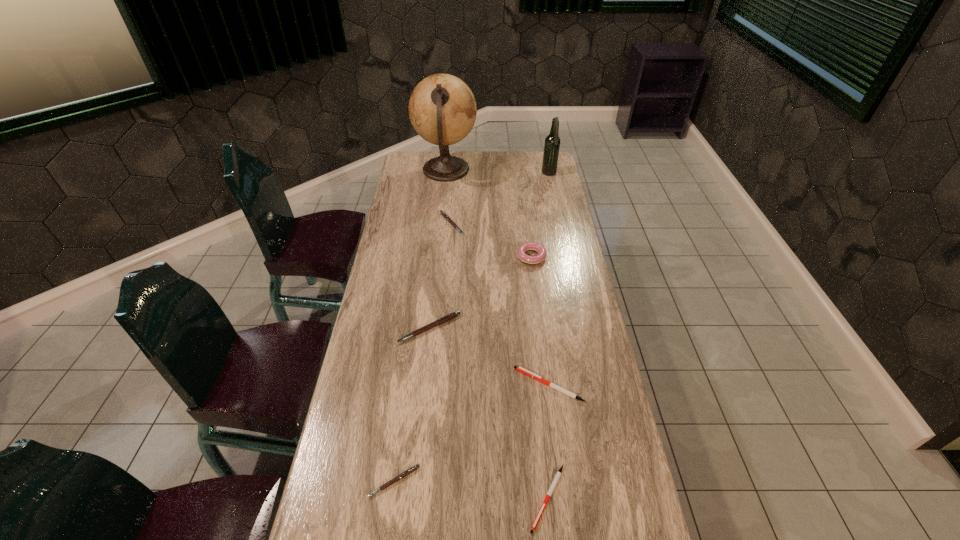
Choose which object is the sixth nearest neighbor to the nearest pink pen. Please provide its 2D coordinates. Your answer should be formatted as a tuple, i.e. [(x, y)], where the tuple contains the x and y coordinates of a point satisfying the conditions above.

[(442, 109)]

Choose which object is the second nearest neighbor to the smaller white pen. Please provide its 2D coordinates. Your answer should be formatted as a tuple, i.e. [(x, y)], where the tuple contains the x and y coordinates of a point satisfying the conditions above.

[(412, 469)]

You are a GUI agent. You are given a task and a screenshot of the screen. Output one action in this format:
    pyautogui.click(x=<x>, y=<y>)
    Task: Click on the pen that is the fifth closest one to the globe
    The width and height of the screenshot is (960, 540).
    Given the screenshot: What is the action you would take?
    pyautogui.click(x=558, y=474)

Locate which pen ranks second in proximity to the second biggest pink pen. Please provide its 2D coordinates. Your answer should be formatted as a tuple, i.e. [(x, y)], where the tuple contains the x and y coordinates of a point satisfying the conditions above.

[(520, 369)]

You are a GUI agent. You are given a task and a screenshot of the screen. Output one action in this format:
    pyautogui.click(x=<x>, y=<y>)
    Task: Click on the third closest pink pen to the farther white pen
    This screenshot has height=540, width=960.
    Given the screenshot: What is the action you would take?
    pyautogui.click(x=444, y=215)

This screenshot has width=960, height=540. I want to click on pink pen that is the third closest to the third nearest object, so click(x=444, y=215).

Identify which white pen is located as the nearest to the second smallest pink pen. Please provide its 2D coordinates. Your answer should be formatted as a tuple, i.e. [(x, y)], where the tuple contains the x and y coordinates of a point satisfying the conditions above.

[(520, 369)]

Find the location of a particular element. The image size is (960, 540). white pen that can be found as the second closest to the smallest pink pen is located at coordinates (520, 369).

At what (x,y) coordinates should I click in order to perform the action: click on vacant area in the image that satisfies the following two spatial constraints: 1. on the front-facing side of the dark beer bottle; 2. on the left side of the tallest object. Please return your answer as a coordinate pair (x, y). Looking at the image, I should click on (445, 174).

Locate an element on the screen. The image size is (960, 540). vacant area in the image that satisfies the following two spatial constraints: 1. at the nib of the farthest pink pen; 2. at the nib of the nearest pink pen is located at coordinates (432, 481).